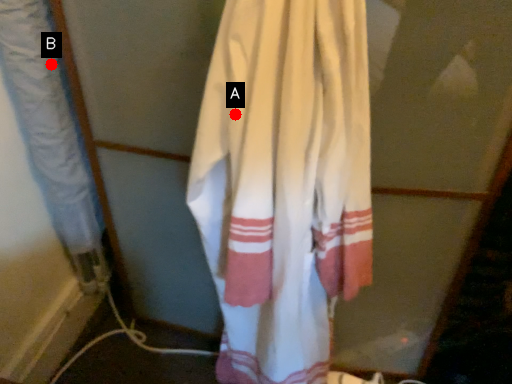
Question: Two points are circled on the image, labeled by A and B beside each circle. Which point appears closest to the camera in this image?

Choices:
 (A) A is closer
 (B) B is closer

Answer: (A)